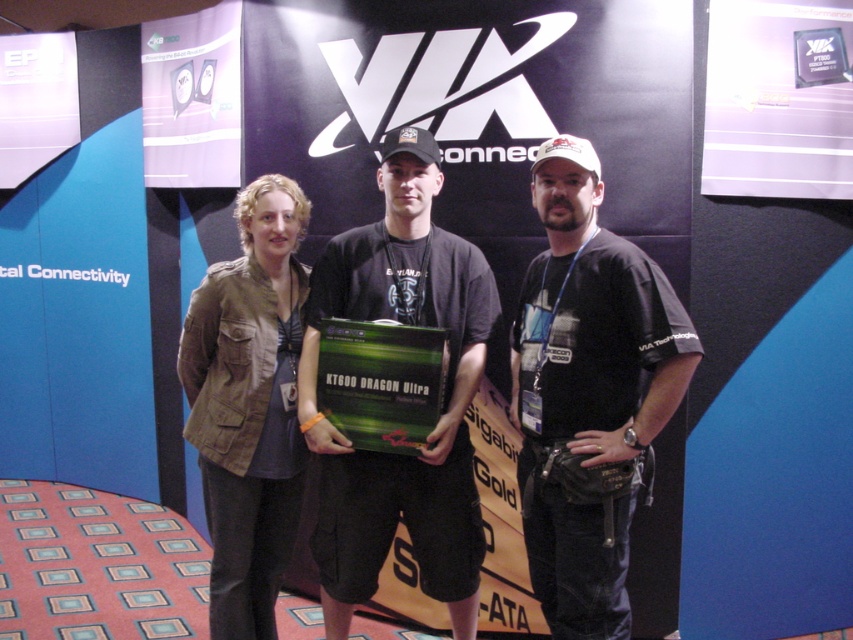
Question: Which of the following is the closest to the observer?

Choices:
 (A) (370, 236)
 (B) (199, 433)

Answer: (A)

Question: Can you confirm if matte black shirt at center is wider than khaki fabric jacket at left?

Choices:
 (A) yes
 (B) no

Answer: (A)

Question: Is black fabric t-shirt at center bigger than matte black shirt at center?

Choices:
 (A) yes
 (B) no

Answer: (A)

Question: Can you confirm if black fabric t-shirt at center is bigger than khaki fabric jacket at left?

Choices:
 (A) yes
 (B) no

Answer: (A)

Question: Which of these objects is positioned farthest from the khaki fabric jacket at left?

Choices:
 (A) black fabric t-shirt at center
 (B) matte black shirt at center

Answer: (A)

Question: Which object appears closest to the camera in this image?

Choices:
 (A) matte black shirt at center
 (B) black fabric t-shirt at center
 (C) khaki fabric jacket at left

Answer: (B)